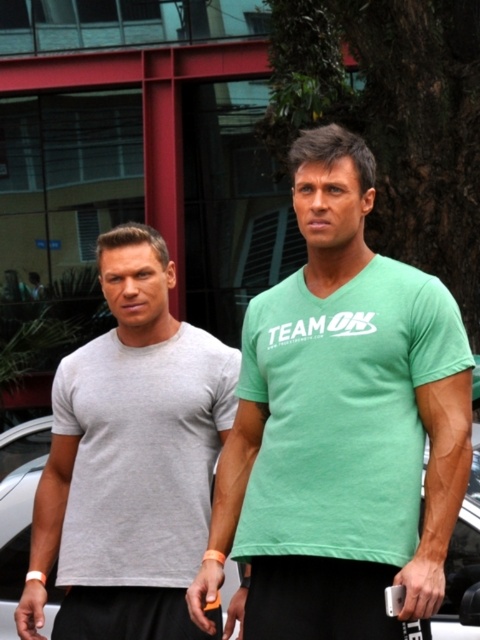
You are standing in front of the modern building with the two people. There is a point marked at coordinates [342,426]. Which object is located at that point?

The point at coordinates [342,426] marks the green matte tshirt at center.